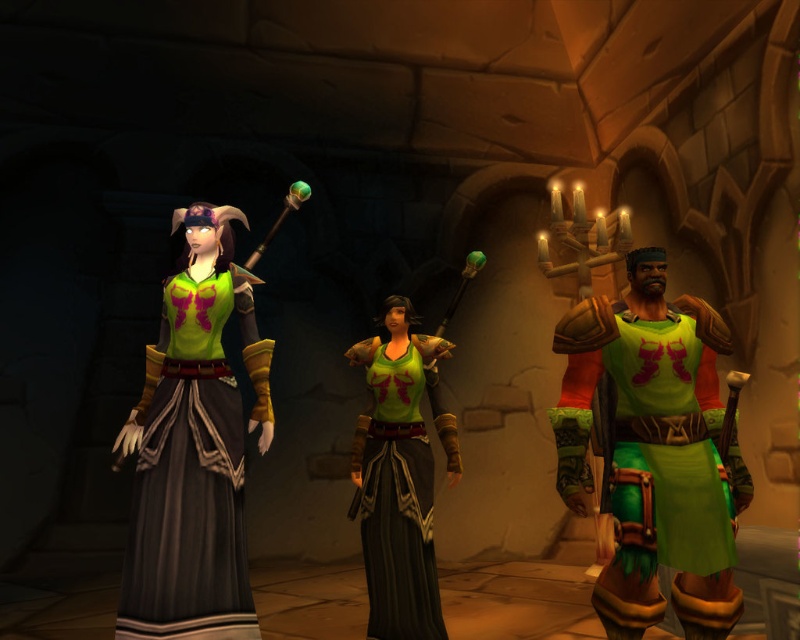
You are standing in a dimly lit stone chamber with two female characters. One is wearing a green matte vest at right and the other a green matte tank top at center. Which one is positioned closer to you?

The green matte vest at right is closer to the viewer than the green matte tank top at center.